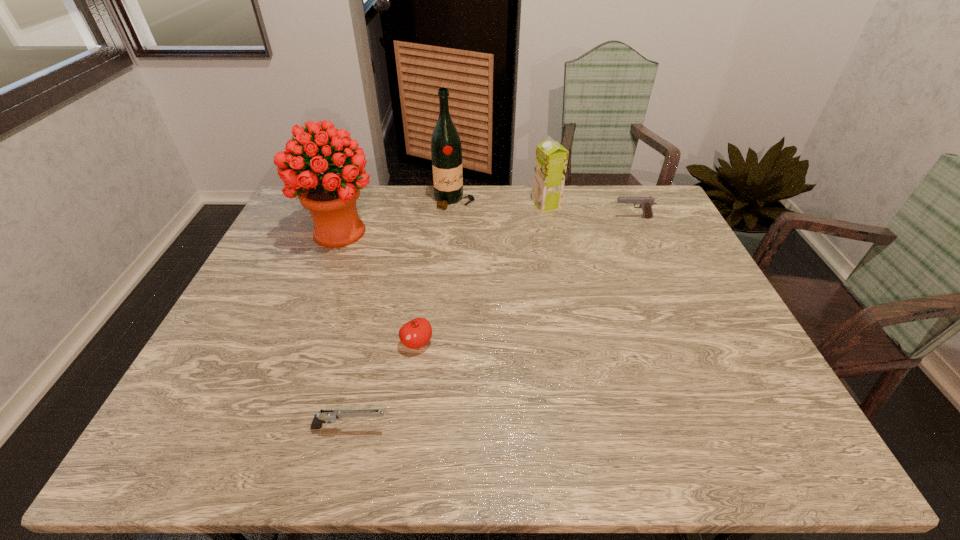
You are a GUI agent. You are given a task and a screenshot of the screen. Output one action in this format:
    pyautogui.click(x=<x>, y=<y>)
    Task: Click on the vacant space located 0.310m on the right of the bouquet
    This screenshot has height=540, width=960.
    Given the screenshot: What is the action you would take?
    pyautogui.click(x=477, y=232)

This screenshot has height=540, width=960. Find the location of `blank area located 0.310m on the left of the fourth shortest object`. blank area located 0.310m on the left of the fourth shortest object is located at coordinates (443, 205).

Identify the location of free space located at the barrel of the rightmost object. The height and width of the screenshot is (540, 960). (589, 218).

Identify the location of free region located 0.230m at the barrel of the rightmost object. This screenshot has height=540, width=960. (544, 218).

Find the location of `vacant area situated at the barrel of the rightmost object`. vacant area situated at the barrel of the rightmost object is located at coordinates (581, 218).

You are a GUI agent. You are given a task and a screenshot of the screen. Output one action in this format:
    pyautogui.click(x=<x>, y=<y>)
    Task: Click on the vacant area located on the right of the second nearest object
    The width and height of the screenshot is (960, 540).
    Given the screenshot: What is the action you would take?
    pyautogui.click(x=487, y=343)

Identify the location of vacant space located on the front-facing side of the nearest object. (485, 428).

You are a GUI agent. You are given a task and a screenshot of the screen. Output one action in this format:
    pyautogui.click(x=<x>, y=<y>)
    Task: Click on the wine bottle present at the far edge
    Image resolution: width=960 pixels, height=540 pixels.
    Given the screenshot: What is the action you would take?
    click(446, 150)

I want to click on bouquet present at the far edge, so click(331, 197).

Find the location of `soya milk present at the far edge`. soya milk present at the far edge is located at coordinates [551, 159].